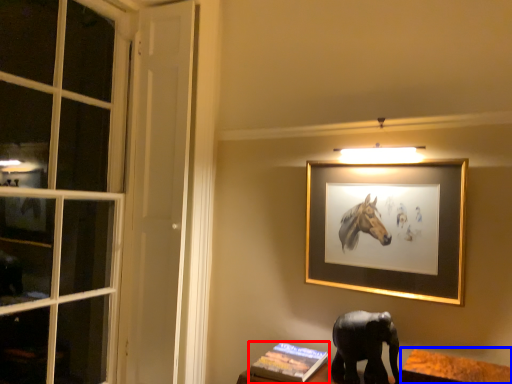
Question: Which of the following is the closest to the observer, book (highlighted by a red box) or table (highlighted by a blue box)?

Choices:
 (A) book
 (B) table

Answer: (B)